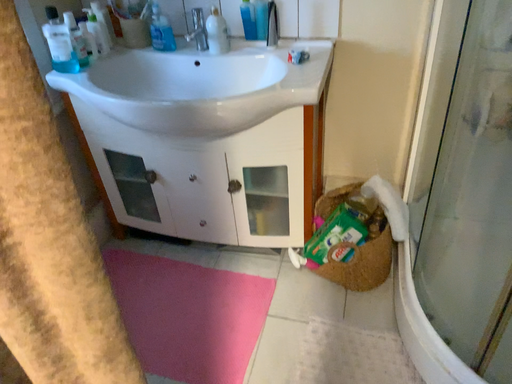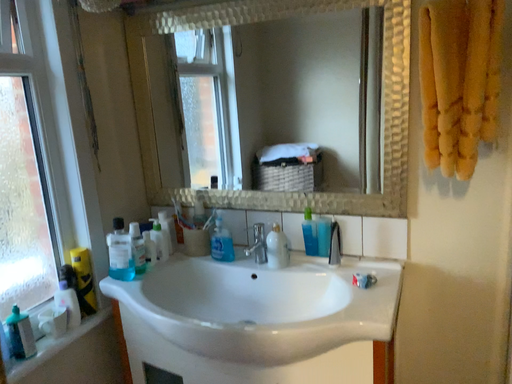
Question: Which way did the camera rotate in the video?

Choices:
 (A) rotated upward
 (B) rotated downward

Answer: (A)